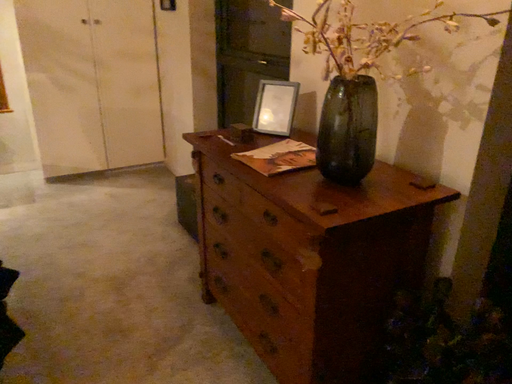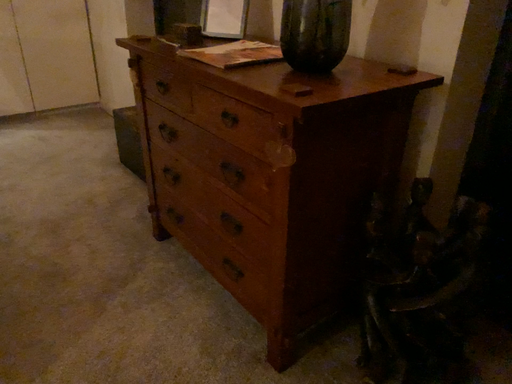
Question: Which way did the camera rotate in the video?

Choices:
 (A) rotated right
 (B) rotated left

Answer: (A)